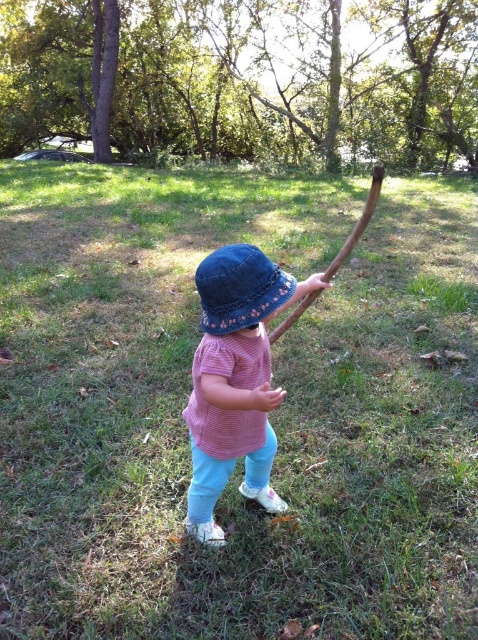
Who is more distant from viewer, (274, 394) or (279, 301)?

The point (279, 301) is behind.

Is pink striped shirt at center in front of denim hat at center?

That is True.

Does point (231, 460) lie in front of point (252, 272)?

No, (231, 460) is behind (252, 272).

Locate an element on the screen. This screenshot has width=478, height=640. pink striped shirt at center is located at coordinates (235, 380).